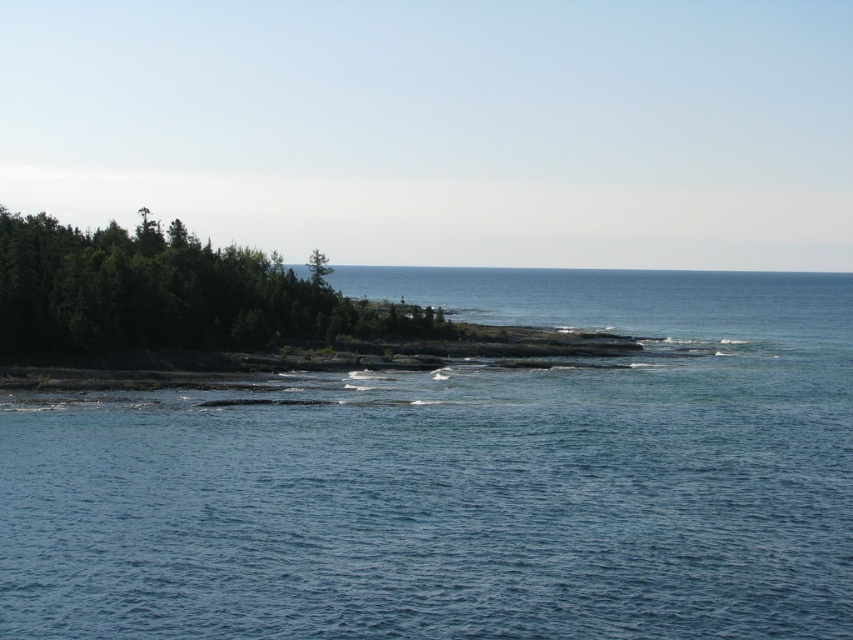
Can you confirm if blue water at center is shorter than green leafy trees at left?

Incorrect, blue water at center's height does not fall short of green leafy trees at left's.

Between blue water at center and green leafy trees at left, which one is positioned lower?

blue water at center

Measure the distance between point (827, 340) and camera.

They are 441.73 feet apart.

Locate an element on the screen. blue water at center is located at coordinates (465, 481).